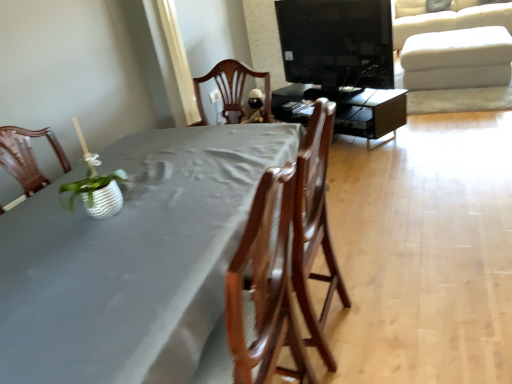
Question: Is matte black tv stand at center, the 2th table from the front, far from wooden chair at center?

Choices:
 (A) yes
 (B) no

Answer: (A)

Question: Is matte black tv stand at center, which is counted as the second table, starting from the bottom, at the right side of wooden chair at center?

Choices:
 (A) yes
 (B) no

Answer: (A)

Question: Is matte black tv stand at center, the 2th table from the front, wider than wooden chair at center?

Choices:
 (A) yes
 (B) no

Answer: (A)

Question: Is matte black tv stand at center, which is counted as the second table, starting from the bottom, completely or partially outside of wooden chair at center?

Choices:
 (A) no
 (B) yes

Answer: (B)

Question: Is matte black tv stand at center, which is counted as the second table, starting from the bottom, behind wooden chair at center?

Choices:
 (A) no
 (B) yes

Answer: (B)

Question: Is wooden chair at center located within matte black tv stand at center, the 2th table from the front?

Choices:
 (A) no
 (B) yes

Answer: (A)

Question: Is white textured pot at left thinner than wooden chair at center?

Choices:
 (A) no
 (B) yes

Answer: (B)

Question: Could wooden chair at center be considered to be inside white textured pot at left?

Choices:
 (A) yes
 (B) no

Answer: (B)

Question: Does white textured pot at left have a greater height compared to wooden chair at center?

Choices:
 (A) no
 (B) yes

Answer: (A)

Question: From a real-world perspective, does white textured pot at left stand above wooden chair at center?

Choices:
 (A) yes
 (B) no

Answer: (A)

Question: From a real-world perspective, is white textured pot at left under wooden chair at center?

Choices:
 (A) yes
 (B) no

Answer: (B)

Question: Considering the relative positions of white textured pot at left and wooden chair at center in the image provided, is white textured pot at left to the right of wooden chair at center from the viewer's perspective?

Choices:
 (A) no
 (B) yes

Answer: (A)

Question: Would you consider white textured pot at left to be distant from black glossy tv at upper center?

Choices:
 (A) no
 (B) yes

Answer: (B)